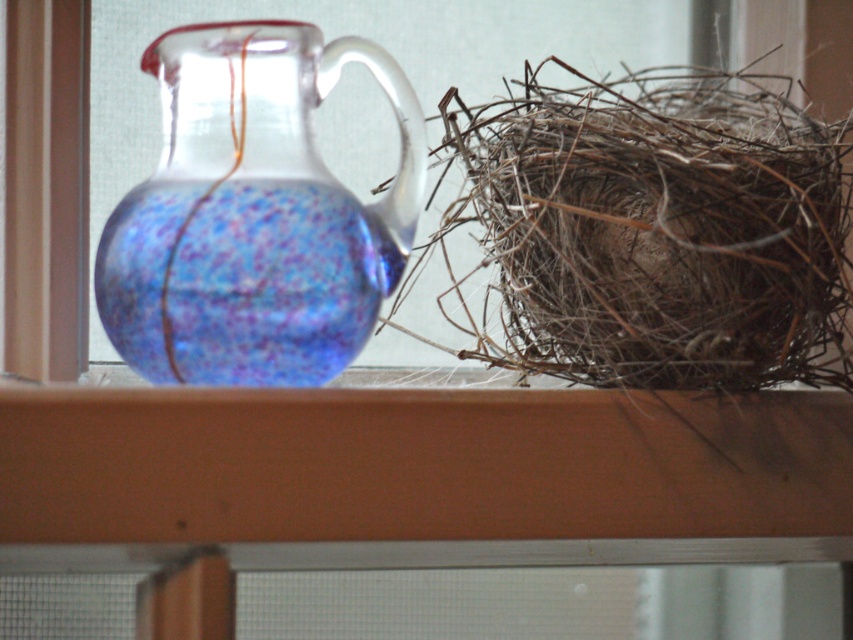
Question: Considering the relative positions of brown twigs nest at right and matte glass jug at left in the image provided, where is brown twigs nest at right located with respect to matte glass jug at left?

Choices:
 (A) left
 (B) right

Answer: (B)

Question: Observing the image, what is the correct spatial positioning of brown twigs nest at right in reference to matte glass jug at left?

Choices:
 (A) right
 (B) left

Answer: (A)

Question: Does brown twigs nest at right appear on the right side of matte glass jug at left?

Choices:
 (A) no
 (B) yes

Answer: (B)

Question: Which of the following is the farthest from the observer?

Choices:
 (A) (538, 333)
 (B) (235, 312)

Answer: (A)